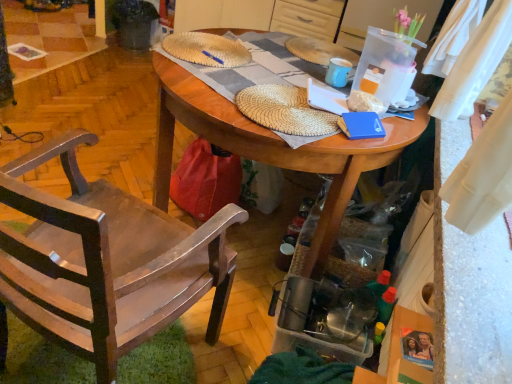
Identify the location of vacant space to the right of woven straw hat at upper center, marked as the second hat in a front-to-back arrangement. (279, 67).